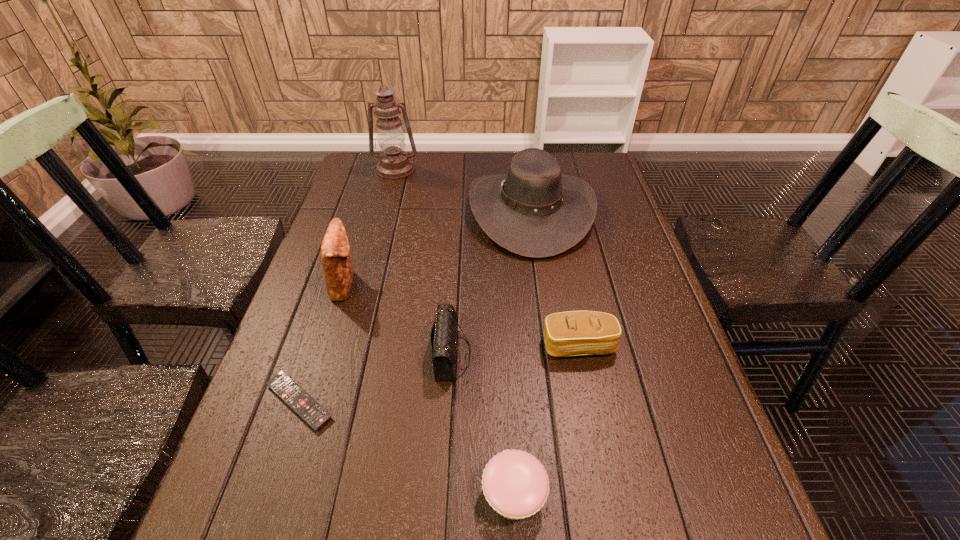
Locate an element on the screen. This screenshot has width=960, height=540. free spot located 0.350m on the front-facing side of the cowboy hat is located at coordinates (353, 212).

You are a GUI agent. You are given a task and a screenshot of the screen. Output one action in this format:
    pyautogui.click(x=<x>, y=<y>)
    Task: Click on the free region located on the front-facing side of the cowboy hat
    
    Given the screenshot: What is the action you would take?
    pyautogui.click(x=403, y=212)

Identify the location of free region located 0.130m on the front-facing side of the cowboy hat. This screenshot has width=960, height=540. coord(426,212).

You are a GUI agent. You are given a task and a screenshot of the screen. Output one action in this format:
    pyautogui.click(x=<x>, y=<y>)
    Task: Click on the free region located 0.220m on the open side of the third farthest object
    
    Given the screenshot: What is the action you would take?
    pyautogui.click(x=445, y=284)

Locate an element on the screen. vacant region located on the front flap of the second clutch bag from right to left is located at coordinates (582, 355).

You are a GUI agent. You are given a task and a screenshot of the screen. Output one action in this format:
    pyautogui.click(x=<x>, y=<y>)
    Task: Click on the vacant area situated 0.220m on the zipper side of the rightmost clutch bag
    
    Given the screenshot: What is the action you would take?
    pyautogui.click(x=603, y=466)

The image size is (960, 540). In order to click on vacant area situated 0.310m on the right of the nearest object in this screenshot , I will do `click(729, 495)`.

Find the location of a particular element. This screenshot has height=540, width=960. free space located 0.250m on the back of the shortest object is located at coordinates (336, 288).

What are the coordinates of `oil lamp present at the far edge` in the screenshot? It's located at [394, 163].

Where is `cowboy hat that is at the far edge`? cowboy hat that is at the far edge is located at coordinates (533, 211).